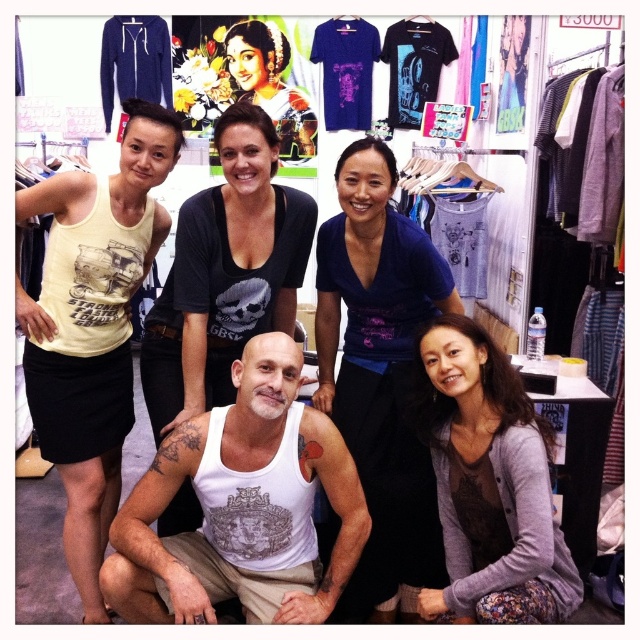
Question: Does matte black tank top at center have a lesser width compared to matte black dress at upper center?

Choices:
 (A) yes
 (B) no

Answer: (A)

Question: Observing the image, what is the correct spatial positioning of white cotton tank top at center in reference to matte black dress at upper center?

Choices:
 (A) left
 (B) right

Answer: (B)

Question: Which point is farther to the camera?

Choices:
 (A) (93, 460)
 (B) (381, 170)
 (C) (230, 182)
 (D) (449, 436)

Answer: (A)

Question: Is yellow matte tank top at left to the left of matte black tank top at center from the viewer's perspective?

Choices:
 (A) yes
 (B) no

Answer: (A)

Question: Estimate the real-world distances between objects in this image. Which object is farther from the matte black tank top at center?

Choices:
 (A) yellow matte tank top at left
 (B) matte black dress at upper center
 (C) gray cardigan at lower right
 (D) white cotton tank top at center

Answer: (B)

Question: Estimate the real-world distances between objects in this image. Which object is farther from the gray cardigan at lower right?

Choices:
 (A) purple matte dress at center
 (B) matte black tank top at center
 (C) matte black dress at upper center
 (D) yellow matte tank top at left

Answer: (C)